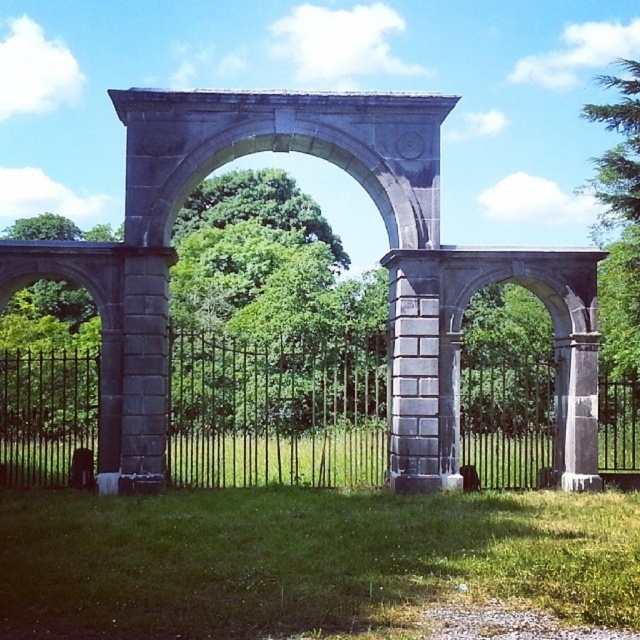
Can you confirm if black wrought iron fence at center is taller than green leafy tree at upper right?

No.

Who is positioned more to the right, black wrought iron fence at center or green leafy tree at upper right?

green leafy tree at upper right

Is point (0, 435) less distant than point (634, 156)?

Yes, it is.

Identify the location of black wrought iron fence at center. (275, 412).

Is green grass at lower center taller than black wrought iron fence at center?

In fact, green grass at lower center may be shorter than black wrought iron fence at center.

Who is lower down, green grass at lower center or black wrought iron fence at center?

Positioned lower is green grass at lower center.

Who is more distant from viewer, [218,513] or [328,404]?

Point [328,404]

I want to click on green grass at lower center, so click(x=307, y=557).

Is green grass at lower center above green leafy tree at upper right?

Actually, green grass at lower center is below green leafy tree at upper right.

Can you confirm if green grass at lower center is positioned to the left of green leafy tree at upper right?

Yes, green grass at lower center is to the left of green leafy tree at upper right.

Image resolution: width=640 pixels, height=640 pixels. What do you see at coordinates (307, 557) in the screenshot? I see `green grass at lower center` at bounding box center [307, 557].

Find the location of `green grass at lower center`. green grass at lower center is located at coordinates (307, 557).